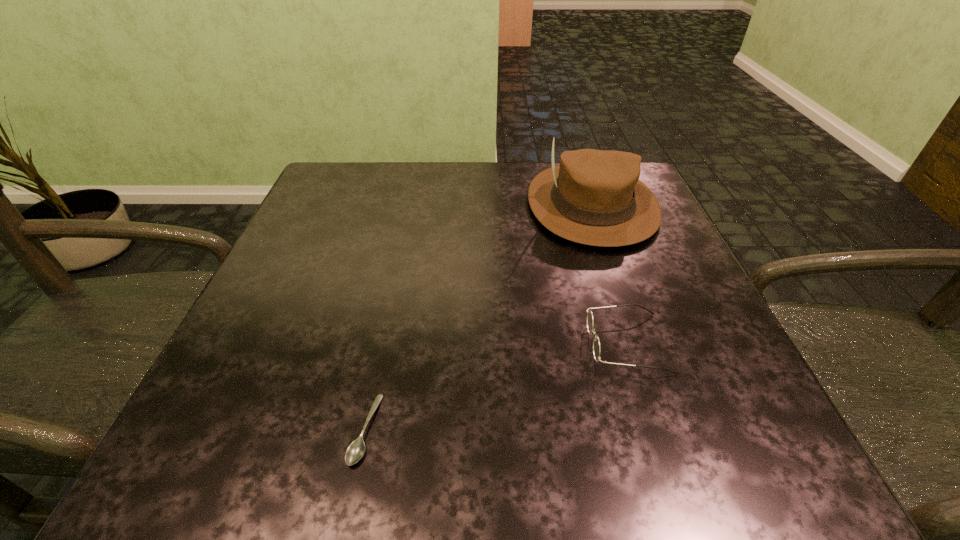
At what (x,y) coordinates should I click in order to perform the action: click on vacant region located 0.110m on the back of the nearest object. Please return your answer as a coordinate pair (x, y). This screenshot has height=540, width=960. Looking at the image, I should click on (385, 335).

The height and width of the screenshot is (540, 960). Find the location of `object that is at the far edge`. object that is at the far edge is located at coordinates (594, 197).

You are a GUI agent. You are given a task and a screenshot of the screen. Output one action in this format:
    pyautogui.click(x=<x>, y=<y>)
    Task: Click on the object present at the near edge
    This screenshot has height=540, width=960.
    Given the screenshot: What is the action you would take?
    pyautogui.click(x=355, y=451)

Locate an element on the screen. The width and height of the screenshot is (960, 540). fedora that is positioned at the right edge is located at coordinates (594, 197).

Locate an element on the screen. The height and width of the screenshot is (540, 960). spectacles present at the right edge is located at coordinates (596, 343).

The height and width of the screenshot is (540, 960). In order to click on object that is at the far right corner in this screenshot , I will do `click(594, 197)`.

Where is `free space at the far edge of the desktop`? free space at the far edge of the desktop is located at coordinates (429, 167).

In the image, there is a desktop. Identify the location of vacant area at the near edge. (390, 452).

Where is `vacant space at the left edge`? The height and width of the screenshot is (540, 960). vacant space at the left edge is located at coordinates (260, 355).

Where is `free region at the right edge of the desktop`? The height and width of the screenshot is (540, 960). free region at the right edge of the desktop is located at coordinates (736, 375).